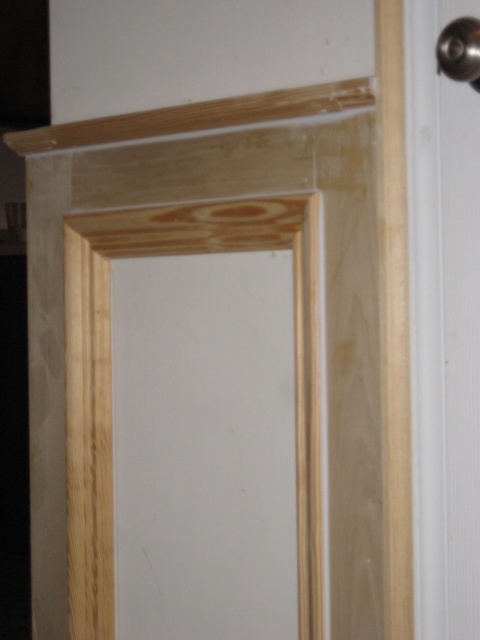
You are a painter holding a 30 cm wide brush. You need to paint the natural wood door at center and the polished metal door handle at upper right. Can you reach both objects with your brush without moving your position?

The natural wood door at center and polished metal door handle at upper right are 36.38 centimeters apart. Since your brush is only 30 cm wide, you cannot reach both objects simultaneously without moving your position.

You are trying to open the door in the image. The natural wood door at center has a polished metal door handle at upper right. Which object would you need to grasp to open the door?

You would need to grasp the polished metal door handle at upper right to open the natural wood door at center, as it is the handle typically used for opening doors.